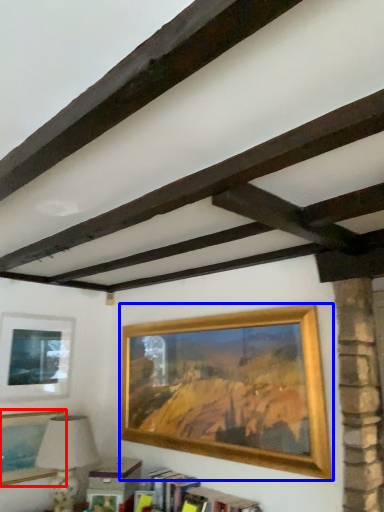
Question: Among these objects, which one is nearest to the camera, picture frame (highlighted by a red box) or picture frame (highlighted by a blue box)?

Choices:
 (A) picture frame
 (B) picture frame

Answer: (B)